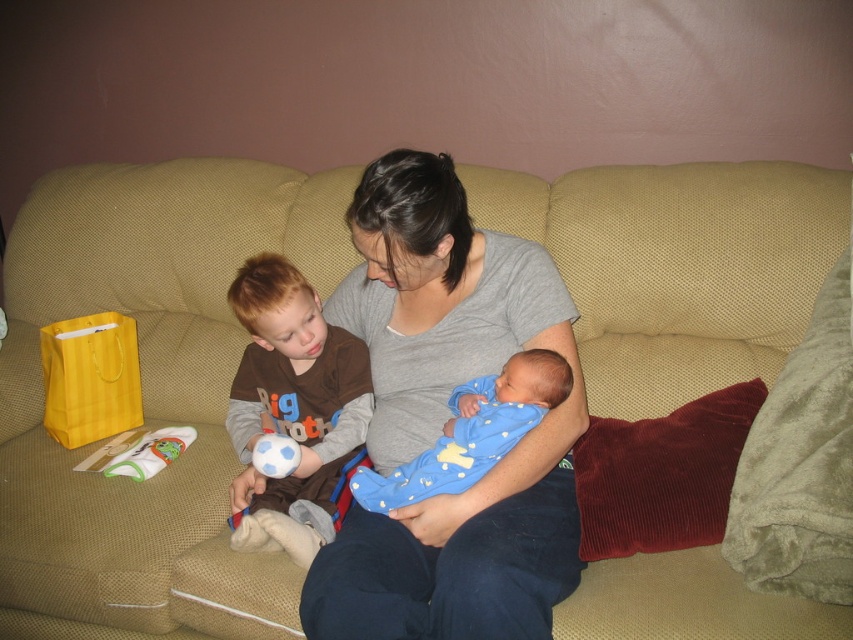
In the scene shown: You are standing in the living room and want to place a small potted plant on the floor exactly at the point marked by coordinates point [524,454]. If you are currently 1.34 meters away from this point, how many steps do you need to take to reach it, assuming each step covers approximately 0.7 meters?

Since the point [524,454] is 1.34 meters away from you, and each step covers 0.7 meters, you would need to take 2 steps to reach it. The first step would cover 0.7 meters, and the second step would cover the remaining 0.64 meters.

You are a photographer setting up a photo shoot in the living room. You need to place a 3D model of a baby on the couch. The model must be placed where the blue soft fabric baby at center is currently located. However, the model is slightly thicker than the original baby. Will the brown cotton shirt at left still be visible from the front after placing the model?

The brown cotton shirt at left is thinner than the blue soft fabric baby at center. Since the model is thicker than the original baby, it might block more of the view, but the brown cotton shirt at left is already thinner, so part of it should still be visible.

Based on the photo, you are a photographer taking a picture of the brown cotton shirt at left and the blue soft fabric baby at center. Which object should you focus on first if you want to capture both in the same frame without moving the camera?

The brown cotton shirt at left is above the blue soft fabric baby at center, so you should focus on the brown cotton shirt at left first to ensure both are in focus since it is closer to the camera.